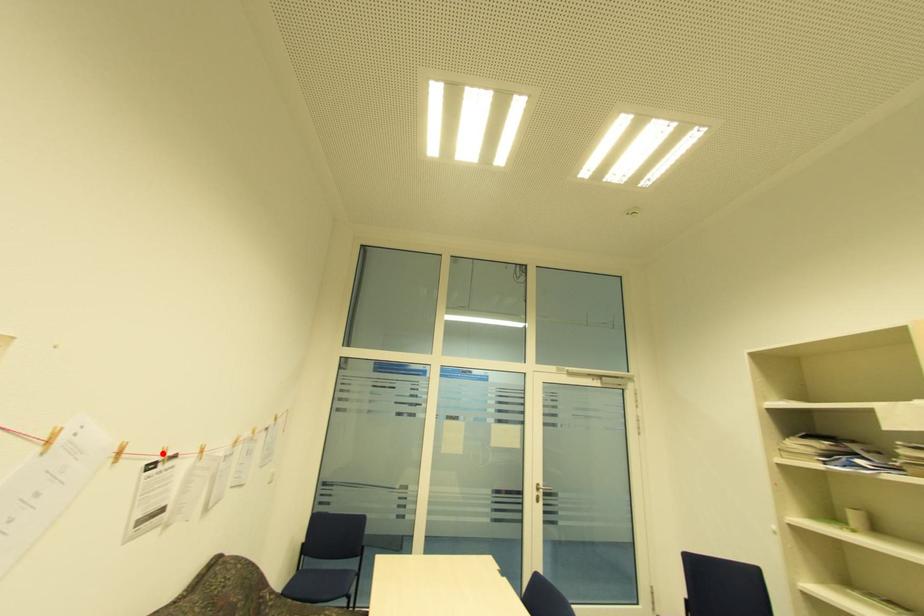
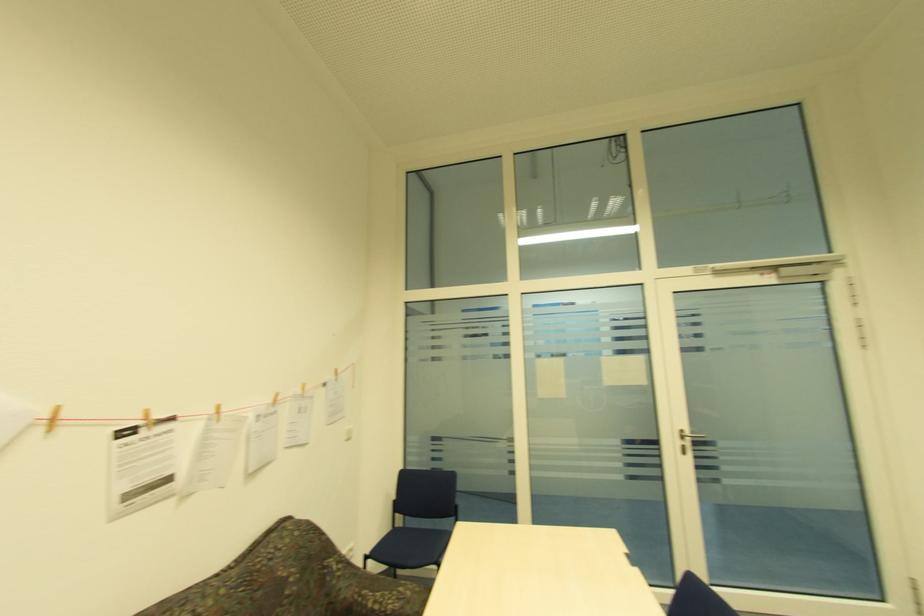
Where in the second image is the point corresponding to the highlighted location from the first image?

(141, 416)